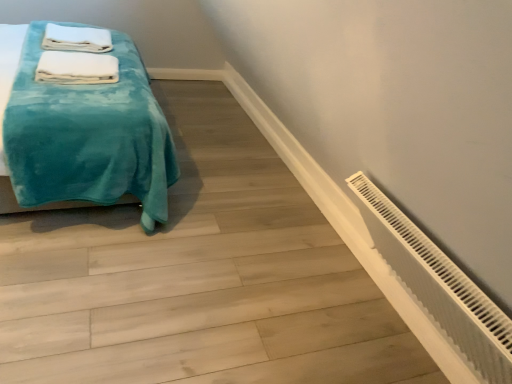
Question: Does white plastic radiator at lower right have a greater width compared to teal plush blanket at left?

Choices:
 (A) no
 (B) yes

Answer: (B)

Question: Are white plastic radiator at lower right and teal plush blanket at left beside each other?

Choices:
 (A) no
 (B) yes

Answer: (A)

Question: Is white plastic radiator at lower right looking in the opposite direction of teal plush blanket at left?

Choices:
 (A) no
 (B) yes

Answer: (B)

Question: Are white plastic radiator at lower right and teal plush blanket at left located far from each other?

Choices:
 (A) yes
 (B) no

Answer: (B)

Question: Does white plastic radiator at lower right have a smaller size compared to teal plush blanket at left?

Choices:
 (A) no
 (B) yes

Answer: (B)

Question: Do you think white soft towel at upper left, the 2th bath towel from the bottom, is within white soft towel at upper left, which is the first bath towel in front-to-back order, or outside of it?

Choices:
 (A) inside
 (B) outside

Answer: (B)

Question: From the image's perspective, is white soft towel at upper left, which ranks as the first bath towel in top-to-bottom order, above or below white soft towel at upper left, which is the first bath towel in front-to-back order?

Choices:
 (A) above
 (B) below

Answer: (A)

Question: Looking at the image, does white soft towel at upper left, which ranks as the first bath towel in top-to-bottom order, seem bigger or smaller compared to white soft towel at upper left, the second bath towel viewed from the back?

Choices:
 (A) big
 (B) small

Answer: (A)

Question: Is white soft towel at upper left, which ranks as the first bath towel in top-to-bottom order, wider or thinner than white soft towel at upper left, the first bath towel ordered from the bottom?

Choices:
 (A) wide
 (B) thin

Answer: (A)

Question: Which is correct: teal plush blanket at left is inside white soft towel at upper left, which is the first bath towel in front-to-back order, or outside of it?

Choices:
 (A) outside
 (B) inside

Answer: (A)

Question: Considering their positions, is teal plush blanket at left located in front of or behind white soft towel at upper left, the 2th bath towel when ordered from top to bottom?

Choices:
 (A) front
 (B) behind

Answer: (A)

Question: From their relative heights in the image, would you say teal plush blanket at left is taller or shorter than white soft towel at upper left, the first bath towel ordered from the bottom?

Choices:
 (A) tall
 (B) short

Answer: (A)

Question: Is teal plush blanket at left to the left or to the right of white soft towel at upper left, which is the first bath towel in front-to-back order, in the image?

Choices:
 (A) right
 (B) left

Answer: (B)

Question: Is white plastic radiator at lower right taller or shorter than teal plush blanket at left?

Choices:
 (A) short
 (B) tall

Answer: (A)

Question: From the image's perspective, relative to teal plush blanket at left, is white plastic radiator at lower right above or below?

Choices:
 (A) below
 (B) above

Answer: (A)